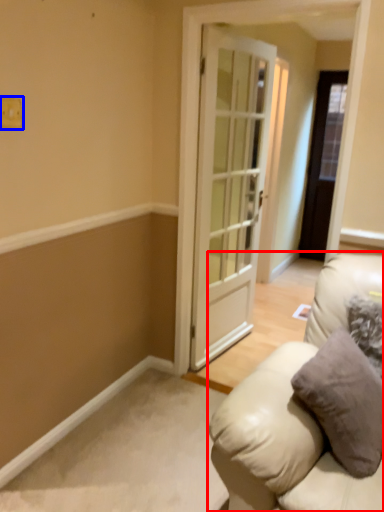
Question: Which object is further to the camera taking this photo, studio couch (highlighted by a red box) or light switch (highlighted by a blue box)?

Choices:
 (A) studio couch
 (B) light switch

Answer: (B)